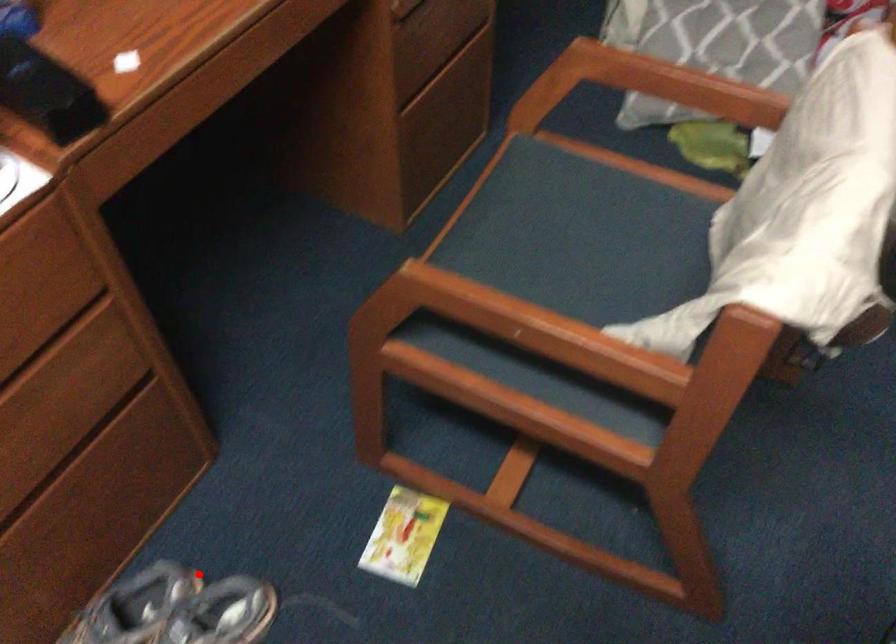
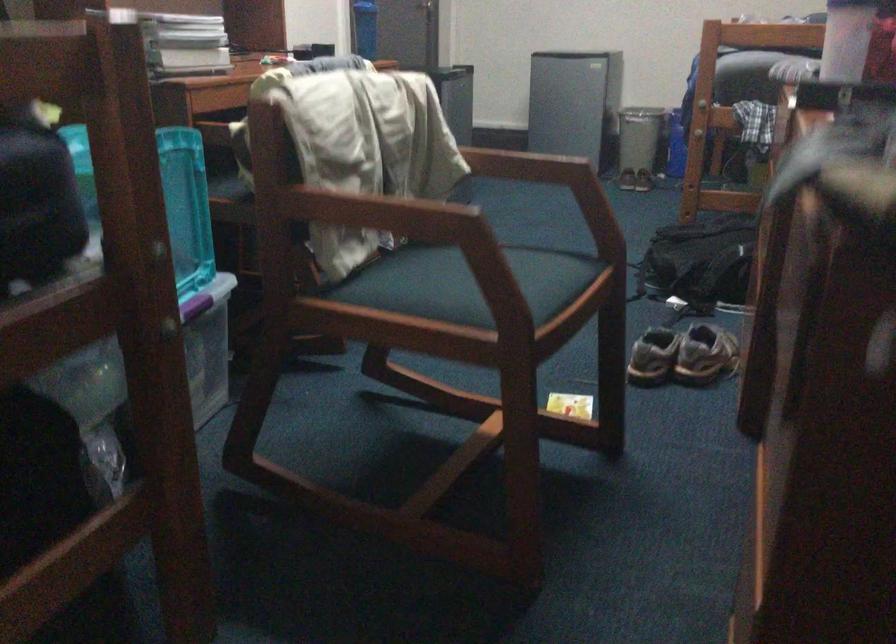
Where in the second image is the point corresponding to the highlighted location from the first image?

(682, 355)